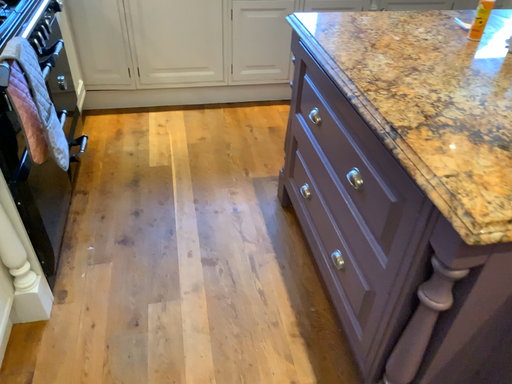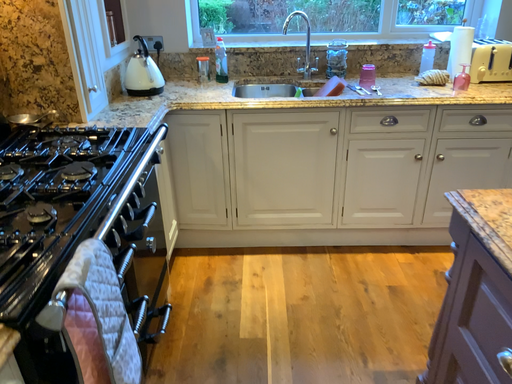
Question: Which way did the camera rotate in the video?

Choices:
 (A) rotated right
 (B) rotated left

Answer: (B)